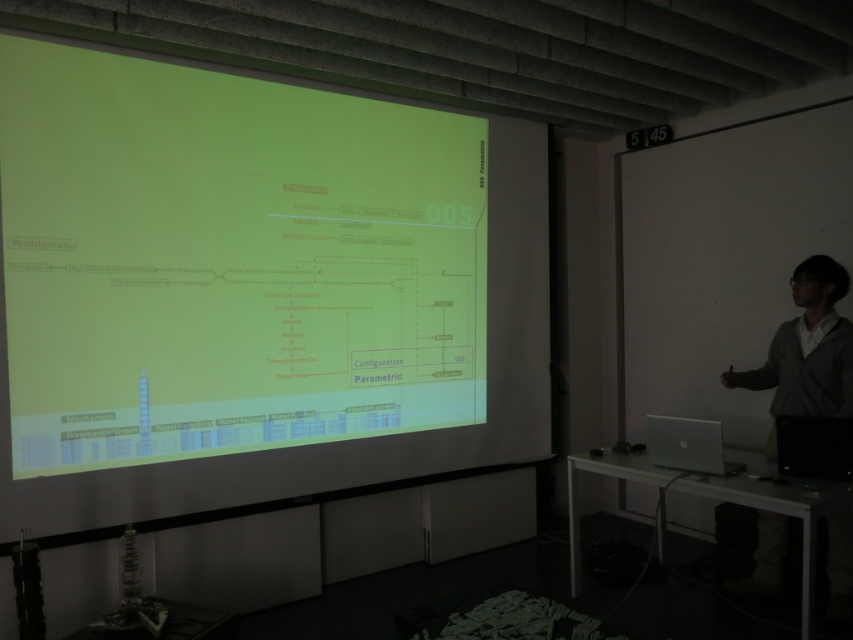
Question: Which of the following is the farthest from the observer?

Choices:
 (A) (778, 417)
 (B) (410, 458)
 (C) (776, 378)

Answer: (B)

Question: Which of the following is the farthest from the observer?

Choices:
 (A) (790, 444)
 (B) (827, 348)
 (C) (688, 458)

Answer: (B)

Question: Does matte yellow projector screen at center appear over black plastic computer at lower right?

Choices:
 (A) no
 (B) yes

Answer: (B)

Question: Can you confirm if black plastic computer at lower right is bigger than silver metallic laptop at lower right?

Choices:
 (A) yes
 (B) no

Answer: (B)

Question: Which point is farther to the camera?

Choices:
 (A) (815, 356)
 (B) (704, 468)

Answer: (A)

Question: Does black plastic computer at lower right have a larger size compared to silver metallic laptop at lower right?

Choices:
 (A) no
 (B) yes

Answer: (A)